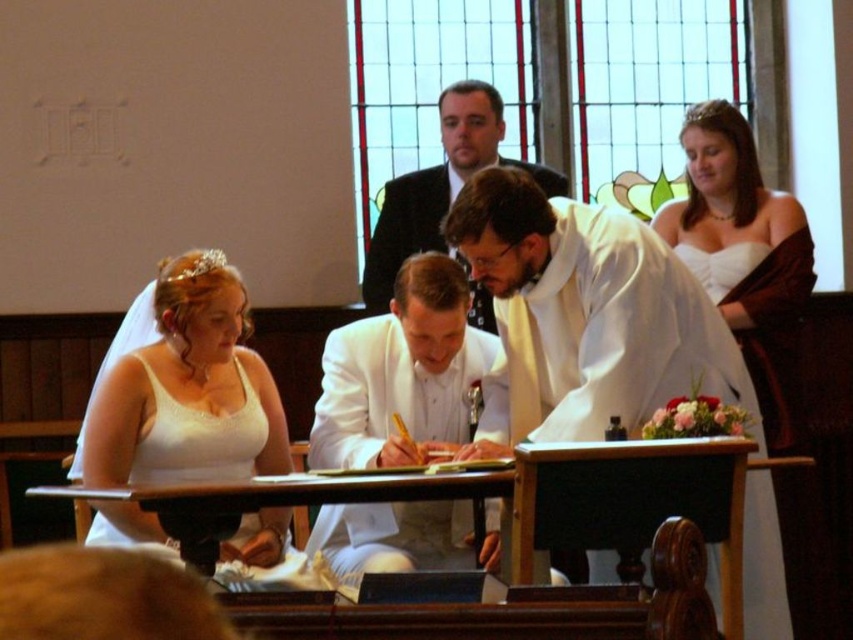
This screenshot has height=640, width=853. What do you see at coordinates (735, 225) in the screenshot? I see `white satin dress at upper right` at bounding box center [735, 225].

Who is lower down, white satin dress at upper right or white matte suit at center?

white satin dress at upper right is below.

Identify the location of white satin dress at upper right. The width and height of the screenshot is (853, 640). (735, 225).

The width and height of the screenshot is (853, 640). Describe the element at coordinates (189, 388) in the screenshot. I see `white satin dress at left` at that location.

Does point (170, 324) come closer to viewer compared to point (711, 484)?

That is False.

Who is more distant from viewer, (233, 371) or (602, 458)?

Positioned behind is point (233, 371).

This screenshot has width=853, height=640. I want to click on white satin dress at left, so click(x=189, y=388).

Can you confirm if white matte vestment at center is positioned above white matte suit at center?

No, white matte vestment at center is not above white matte suit at center.

Can you confirm if white matte vestment at center is wider than white matte suit at center?

Yes, white matte vestment at center is wider than white matte suit at center.

Is point (664, 365) farther from viewer compared to point (486, 320)?

No, it is not.

Identify the location of white matte vestment at center. (584, 317).